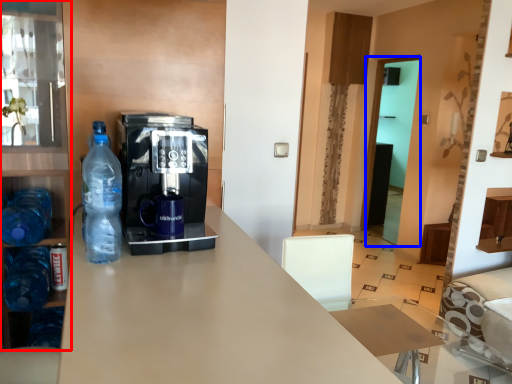
Question: Which object appears closest to the camera in this image, cabinetry (highlighted by a red box) or glass door (highlighted by a blue box)?

Choices:
 (A) cabinetry
 (B) glass door

Answer: (A)